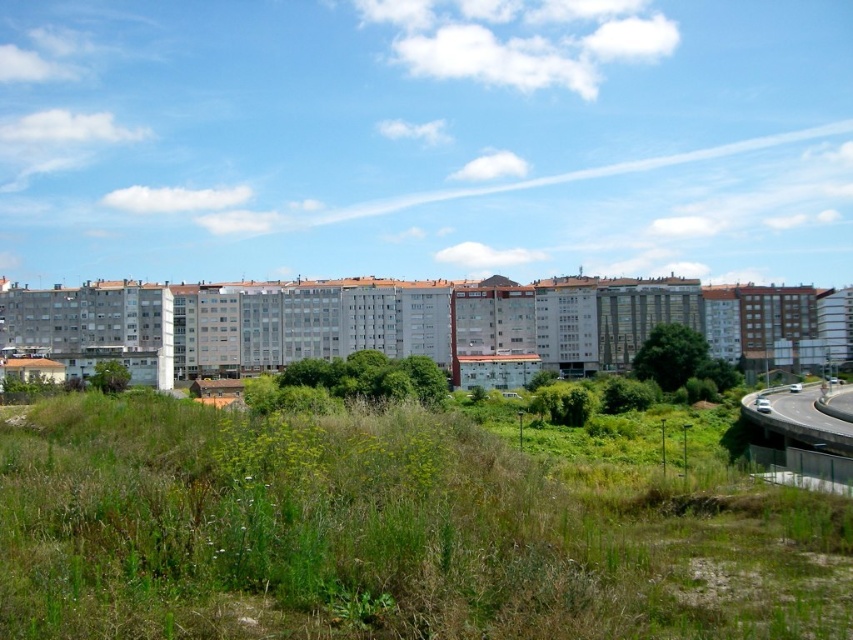
You are a city planner analyzing the urban layout. Given the green grassy at lower center and the gray concrete highway at lower right, which one has a greater horizontal span in the image?

The green grassy at lower center has a greater horizontal span than the gray concrete highway at lower right, as its width surpasses that of the highway.

You are a drone operator tasked with capturing aerial footage of the green grassy at lower center and the gray concrete highway at lower right. To ensure both areas are visible in the same frame, should you adjust your camera angle upwards or downwards?

The green grassy at lower center is located above the gray concrete highway at lower right, so you should adjust your camera angle downwards to capture both areas in the same frame.